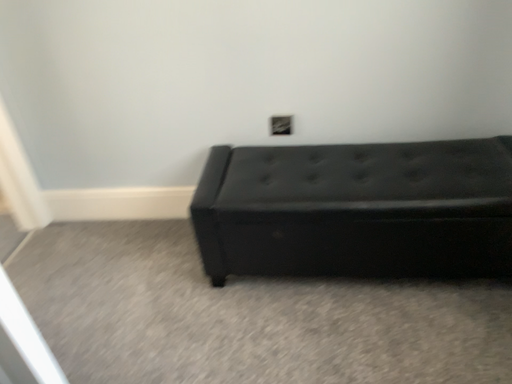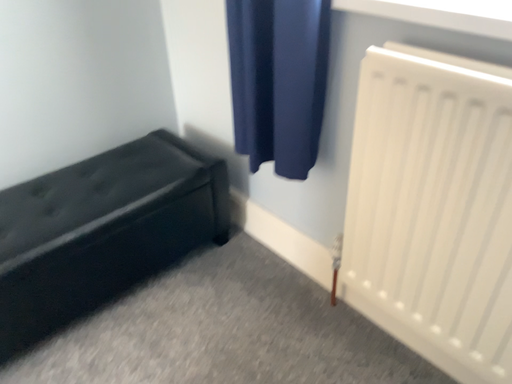
Question: How did the camera likely rotate when shooting the video?

Choices:
 (A) rotated right
 (B) rotated left

Answer: (A)